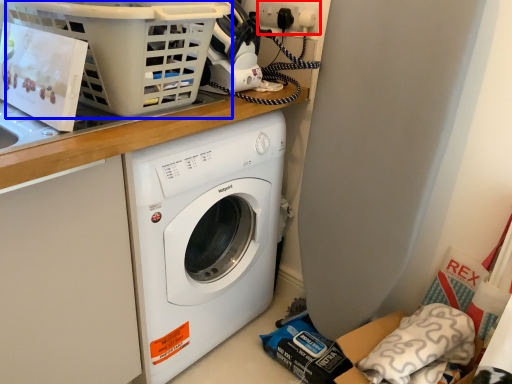
Question: Which object is closer to the camera taking this photo, electric outlet (highlighted by a red box) or basket (highlighted by a blue box)?

Choices:
 (A) electric outlet
 (B) basket

Answer: (B)